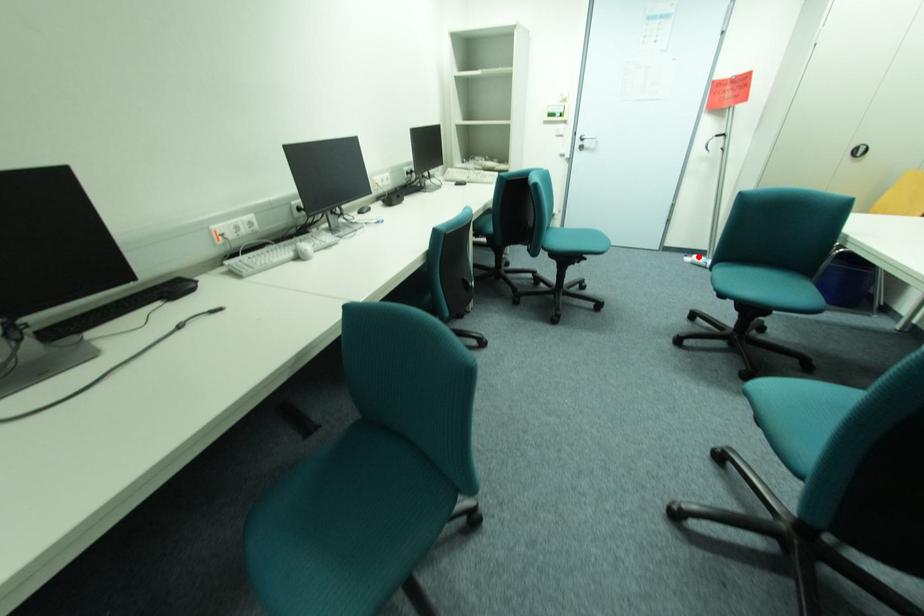
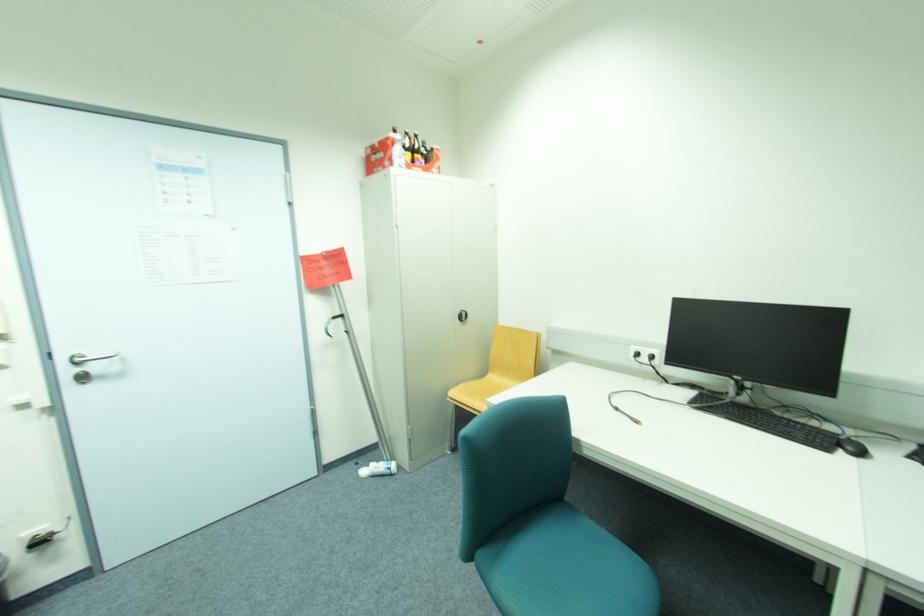
Question: A red point is marked in image1. In image2, is the corresponding 3D point closer to the camera or farther? Reply with the corresponding letter.

Choices:
 (A) The corresponding 3D point is closer.
 (B) The corresponding 3D point is farther.

Answer: (A)